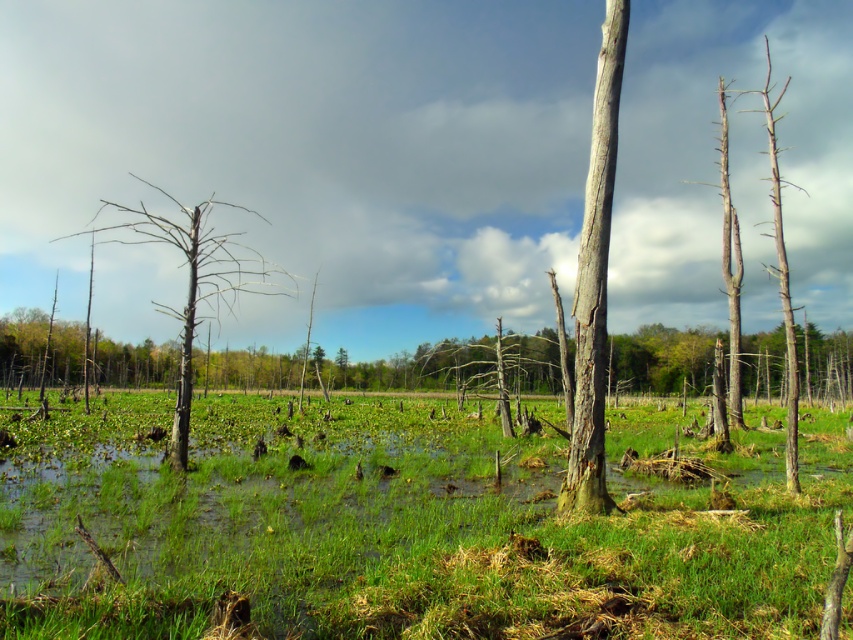
You are a bird flying over the wetland and want to land on the smooth gray bark tree at center. From the gray bark tree at left, which direction should you fly to reach it?

The smooth gray bark tree at center is to the right of the gray bark tree at left, so you should fly to the right to reach it.

You are a bird looking for a nesting spot. You notice two trees in the wetlands scene described. Which tree, the smooth gray bark tree at center or the gray bark tree at left, would be a better choice if you prefer nesting in a taller tree?

The gray bark tree at left is taller than the smooth gray bark tree at center, so it would be a better choice for nesting in a taller tree.

You are standing at the edge of the wetland and notice the green grassy at center and the gray bark tree at left. Which object is positioned to the right side of the other?

The green grassy at center is positioned to the right of the gray bark tree at left.